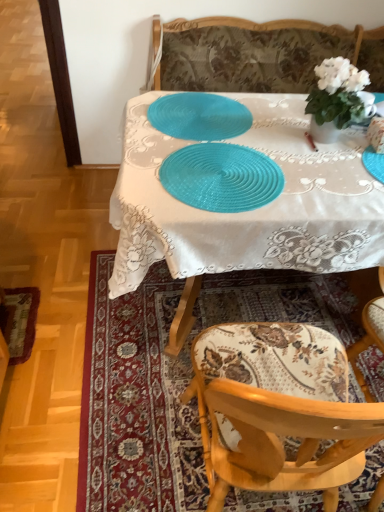
Question: Are blue plastic placemat at center and wooden floral-patterned chair at lower right far apart?

Choices:
 (A) yes
 (B) no

Answer: (B)

Question: Can you confirm if blue plastic placemat at center is thinner than wooden floral-patterned chair at lower right?

Choices:
 (A) no
 (B) yes

Answer: (A)

Question: Does blue plastic placemat at center lie in front of wooden floral-patterned chair at lower right?

Choices:
 (A) no
 (B) yes

Answer: (A)

Question: Does blue plastic placemat at center touch wooden floral-patterned chair at lower right?

Choices:
 (A) no
 (B) yes

Answer: (A)

Question: Does blue plastic placemat at center have a greater width compared to wooden floral-patterned chair at lower right?

Choices:
 (A) yes
 (B) no

Answer: (A)

Question: Is blue plastic placemat at center aimed at wooden floral-patterned chair at lower right?

Choices:
 (A) yes
 (B) no

Answer: (A)

Question: Considering the relative positions of white glossy vase at upper right and teal woven placemat at center, arranged as the first tableware when viewed from the front, in the image provided, is white glossy vase at upper right to the right of teal woven placemat at center, arranged as the first tableware when viewed from the front, from the viewer's perspective?

Choices:
 (A) no
 (B) yes

Answer: (B)

Question: Is white glossy vase at upper right positioned before teal woven placemat at center, acting as the first tableware starting from the bottom?

Choices:
 (A) no
 (B) yes

Answer: (A)

Question: From a real-world perspective, is white glossy vase at upper right positioned under teal woven placemat at center, marked as the 2th tableware in a top-to-bottom arrangement, based on gravity?

Choices:
 (A) yes
 (B) no

Answer: (B)

Question: From the image's perspective, would you say white glossy vase at upper right is shown under teal woven placemat at center, marked as the 2th tableware in a top-to-bottom arrangement?

Choices:
 (A) no
 (B) yes

Answer: (A)

Question: Is white glossy vase at upper right smaller than teal woven placemat at center, marked as the 2th tableware in a top-to-bottom arrangement?

Choices:
 (A) yes
 (B) no

Answer: (B)

Question: Can we say white glossy vase at upper right lies outside teal woven placemat at center, the second tableware viewed from the back?

Choices:
 (A) yes
 (B) no

Answer: (A)

Question: Can you confirm if teal plastic placemat at center, placed as the first tableware when sorted from back to front, is bigger than teal woven placemat at center, arranged as the first tableware when viewed from the front?

Choices:
 (A) no
 (B) yes

Answer: (A)